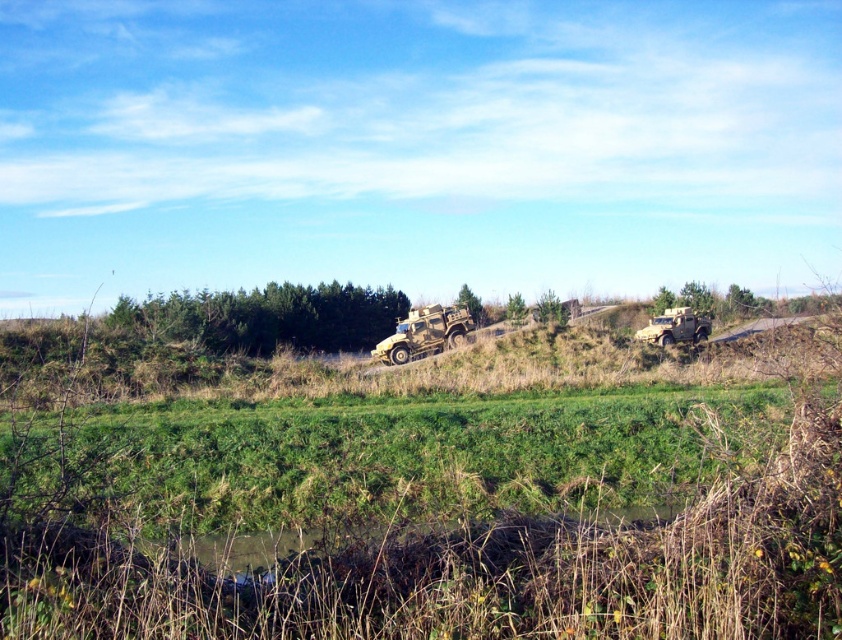
Can you confirm if camouflage fabric military vehicle at center is positioned to the left of camouflage fabric military vehicle at right?

Indeed, camouflage fabric military vehicle at center is positioned on the left side of camouflage fabric military vehicle at right.

Can you confirm if camouflage fabric military vehicle at center is positioned below camouflage fabric military vehicle at right?

No, camouflage fabric military vehicle at center is not below camouflage fabric military vehicle at right.

The width and height of the screenshot is (842, 640). I want to click on camouflage fabric military vehicle at center, so click(425, 333).